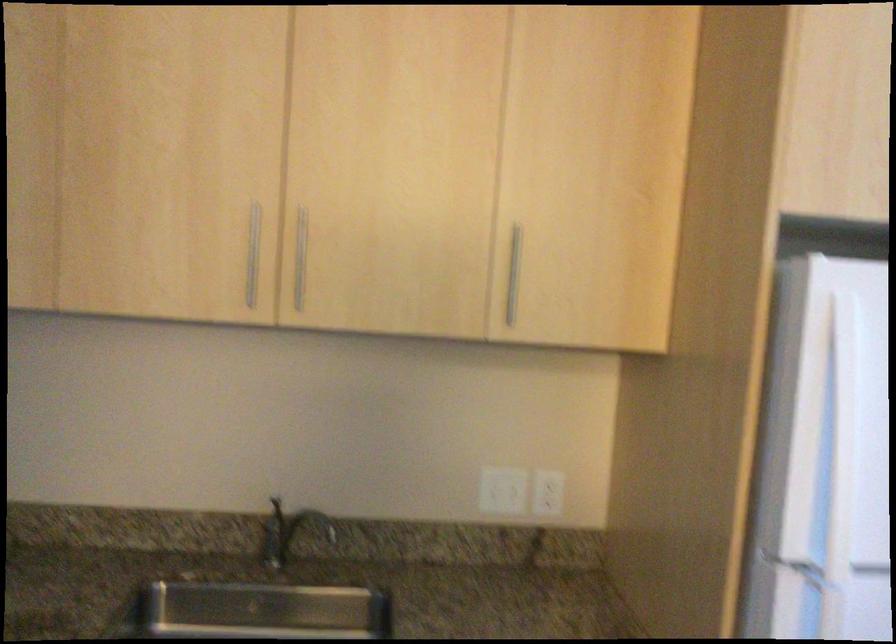
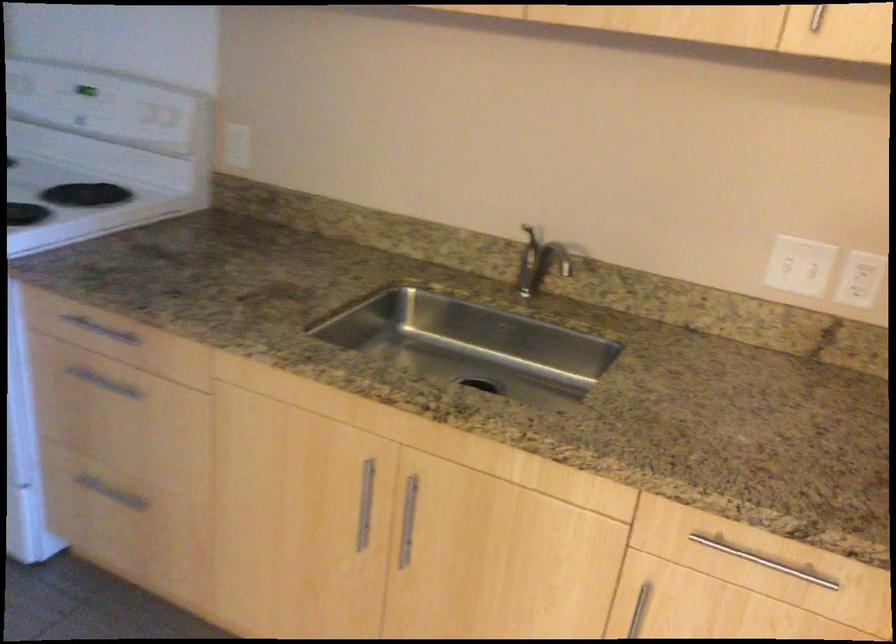
In the second image, find the point that corresponds to pixel 302 518 in the first image.

(545, 251)